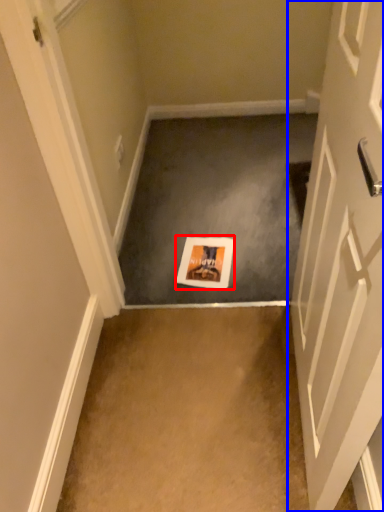
Question: Which object appears closest to the camera in this image, postcard (highlighted by a red box) or door (highlighted by a blue box)?

Choices:
 (A) postcard
 (B) door

Answer: (B)